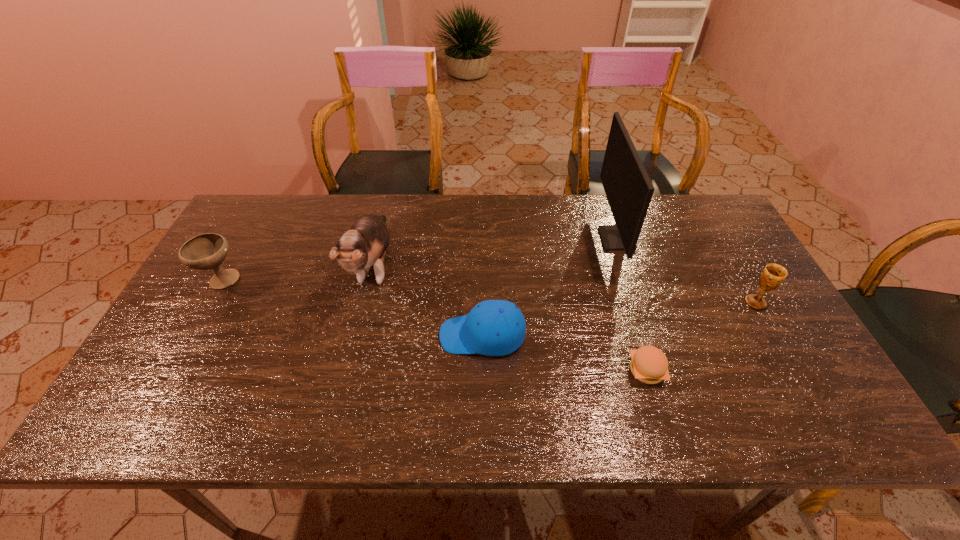
Where is `vacant space that's between the cap and the right chalice`? The height and width of the screenshot is (540, 960). vacant space that's between the cap and the right chalice is located at coordinates (619, 319).

Find the location of a particular element. The width and height of the screenshot is (960, 540). free point between the rightmost object and the cap is located at coordinates [x=619, y=319].

This screenshot has width=960, height=540. Find the location of `vacant point located between the computer monitor and the cat`. vacant point located between the computer monitor and the cat is located at coordinates (495, 252).

In order to click on unoccupied area between the computer monitor and the fifth tallest object in this screenshot , I will do pyautogui.click(x=549, y=287).

Identify the location of blank region between the tallest object and the third object from left to right. The width and height of the screenshot is (960, 540). (549, 287).

Find the location of `vacant space in between the tallest object and the shortest object`. vacant space in between the tallest object and the shortest object is located at coordinates coord(632,305).

This screenshot has width=960, height=540. I want to click on vacant area between the cat and the fifth tallest object, so [x=428, y=301].

This screenshot has width=960, height=540. What are the coordinates of `free space that is in between the third object from left to right and the rightmost object` in the screenshot? It's located at (619, 319).

Image resolution: width=960 pixels, height=540 pixels. What are the coordinates of `the fourth closest object to the leftmost object` in the screenshot? It's located at (628, 188).

Locate which object ranks fourth in proximity to the shortest object. Please provide its 2D coordinates. Your answer should be formatted as a tuple, i.e. [(x, y)], where the tuple contains the x and y coordinates of a point satisfying the conditions above.

[(365, 244)]